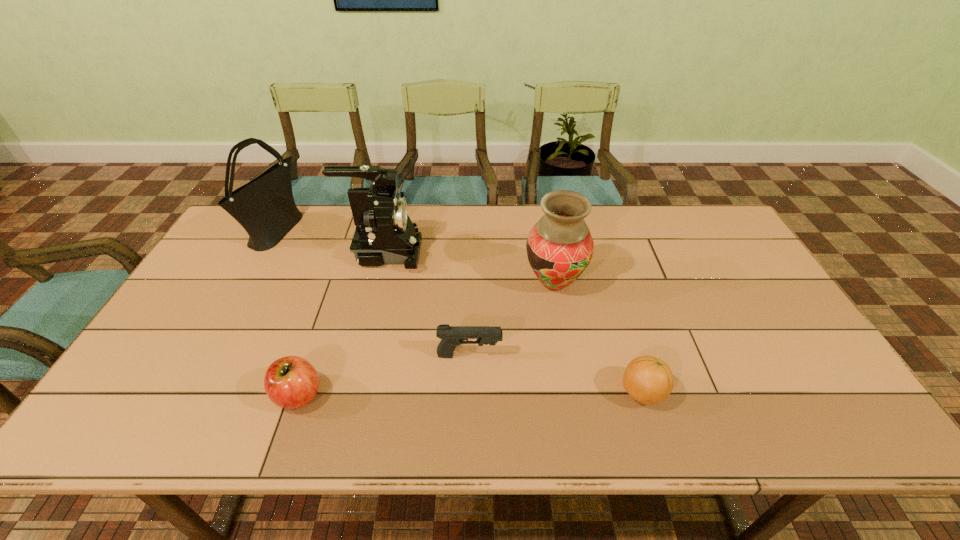
In order to click on vacant space that satisfies the following two spatial constraints: 1. at the barrel of the fourth farthest object; 2. on the back side of the rightmost object in this screenshot , I will do `click(468, 393)`.

Locate an element on the screen. vacant area in the image that satisfies the following two spatial constraints: 1. at the barrel of the orange; 2. on the right side of the third object from right to left is located at coordinates (468, 393).